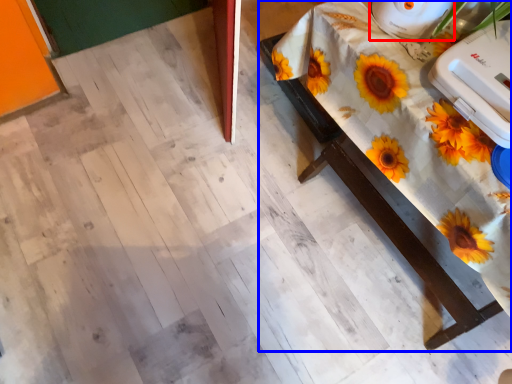
Question: Among these objects, which one is farthest to the camera, appliance (highlighted by a red box) or table (highlighted by a blue box)?

Choices:
 (A) appliance
 (B) table

Answer: (A)